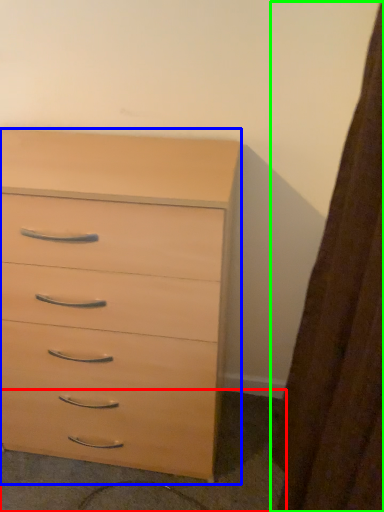
Question: Which object is the farthest from concrete (highlighted by a red box)? Choose among these: chest of drawers (highlighted by a blue box) or curtain (highlighted by a green box).

Choices:
 (A) chest of drawers
 (B) curtain

Answer: (B)